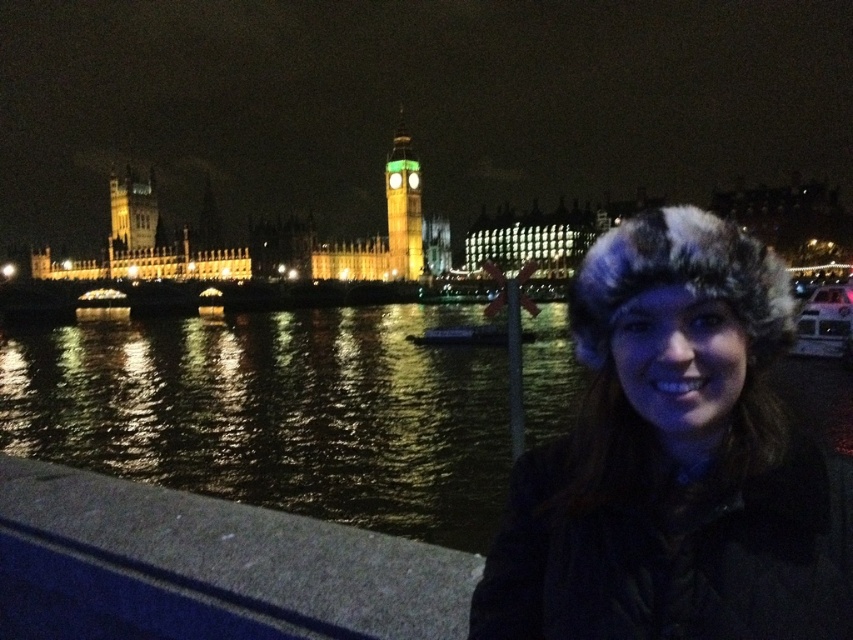
Question: In this image, where is fuzzy fur hat at lower right located relative to glossy water at lower left?

Choices:
 (A) right
 (B) left

Answer: (A)

Question: Is fuzzy fur hat at lower right to the left of concrete at lower left from the viewer's perspective?

Choices:
 (A) yes
 (B) no

Answer: (B)

Question: Estimate the real-world distances between objects in this image. Which object is farther from the glossy water at lower left?

Choices:
 (A) concrete at lower left
 (B) fuzzy fur hat at lower right
 (C) green glass clock tower at center

Answer: (A)

Question: Among these objects, which one is nearest to the camera?

Choices:
 (A) green glass clock tower at center
 (B) concrete at lower left

Answer: (B)

Question: Does glossy water at lower left appear on the left side of concrete at lower left?

Choices:
 (A) no
 (B) yes

Answer: (A)

Question: Which point is farther to the camera?

Choices:
 (A) (218, 572)
 (B) (44, 348)
 (C) (627, 598)

Answer: (B)